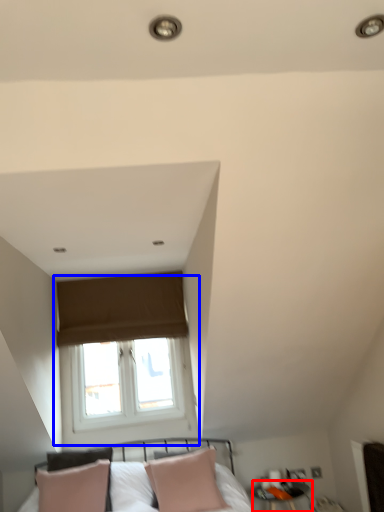
Question: Which object appears farthest to the camera in this image, side table (highlighted by a red box) or window (highlighted by a blue box)?

Choices:
 (A) side table
 (B) window

Answer: (B)